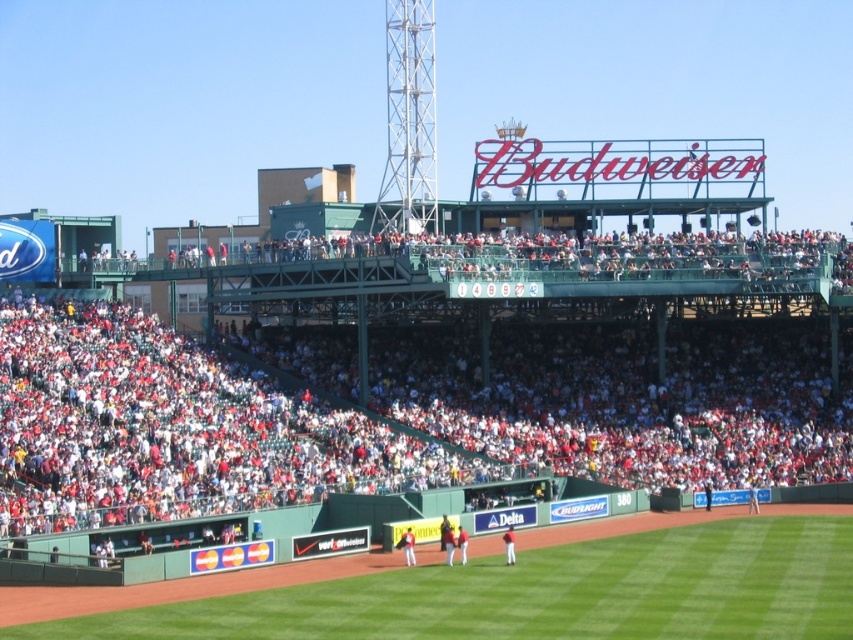
Does point (810, 632) lie behind point (463, 529)?

No, (810, 632) is in front of (463, 529).

Which is more to the right, green grass field at lower center or red baseball uniform at center?

Positioned to the right is green grass field at lower center.

Does point (608, 579) lie behind point (459, 538)?

No.

You are a GUI agent. You are given a task and a screenshot of the screen. Output one action in this format:
    pyautogui.click(x=<x>, y=<y>)
    Task: Click on the green grass field at lower center
    The height and width of the screenshot is (640, 853).
    Given the screenshot: What is the action you would take?
    pyautogui.click(x=509, y=592)

In the scene shown: Between red uniformed players at center and red baseball uniform at center, which one is positioned lower?

Positioned lower is red baseball uniform at center.

Identify the location of red uniformed players at center. The width and height of the screenshot is (853, 640). (393, 412).

Who is more forward, (128, 333) or (460, 540)?

Point (460, 540) is more forward.

The width and height of the screenshot is (853, 640). Find the location of `red uniformed players at center`. red uniformed players at center is located at coordinates (393, 412).

Can you confirm if red baseball uniform at center is thinner than dark blue uniform at center?

Indeed, red baseball uniform at center has a lesser width compared to dark blue uniform at center.

Looking at this image, who is more forward, (463, 547) or (444, 525)?

Point (463, 547) is in front.

Who is more distant from viewer, (459, 534) or (439, 540)?

The point (439, 540) is more distant.

Find the location of a particular element. The height and width of the screenshot is (640, 853). red baseball uniform at center is located at coordinates (462, 545).